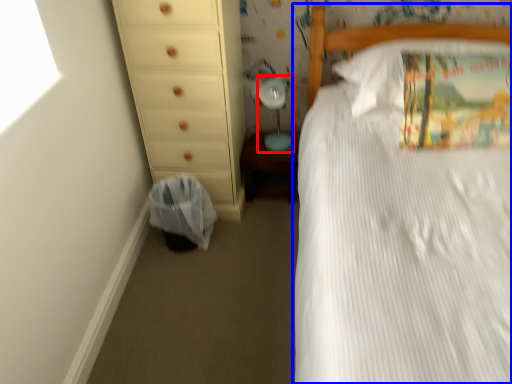
Question: Among these objects, which one is farthest to the camera, table lamp (highlighted by a red box) or bed (highlighted by a blue box)?

Choices:
 (A) table lamp
 (B) bed

Answer: (A)